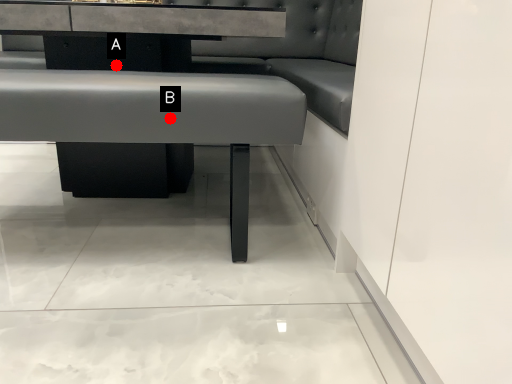
Question: Two points are circled on the image, labeled by A and B beside each circle. Which point is closer to the camera?

Choices:
 (A) A is closer
 (B) B is closer

Answer: (B)